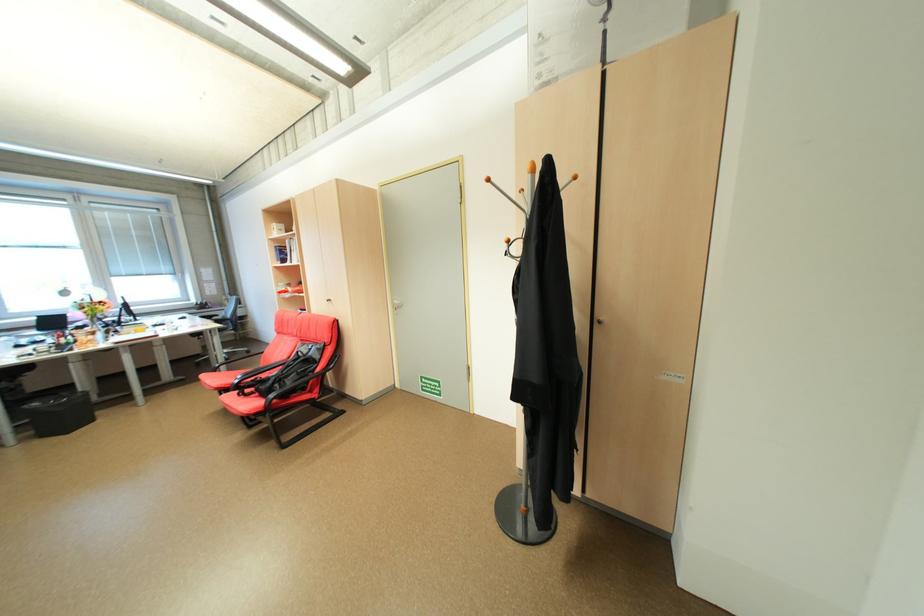
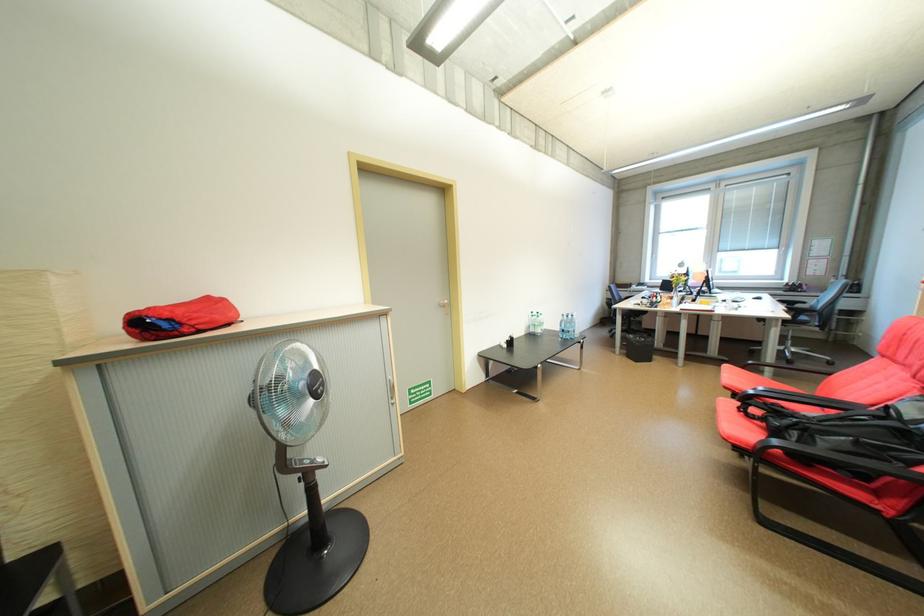
In the second image, find the point that corresponds to point (183, 317) in the first image.

(758, 296)